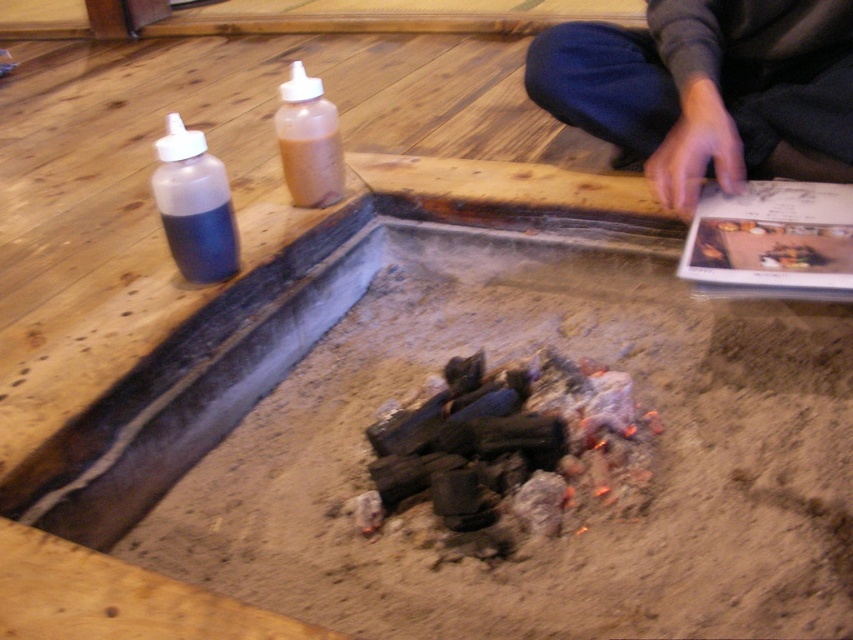
Please provide the 2D coordinates of the dark gray sweater at upper right in the image.

The dark gray sweater at upper right is located at coordinates (x=708, y=90).

Based on the photo, you are a guest at a campsite and need to choose a bottle to pour water into the fire pit. The transparent plastic bottle at left and the translucent plastic bottle at center are available. Which bottle can hold more water?

The translucent plastic bottle at center can hold more water because it is larger than the transparent plastic bottle at left.

You are organizing items in the area around the fire pit. You need to place the dark gray sweater at upper right and the translucent plastic bottle at center on a shelf that can only hold items narrower than the bottle. Will both items fit?

The dark gray sweater at upper right is wider than the translucent plastic bottle at center. Since the shelf can only hold items narrower than the bottle, the sweater will not fit, but the bottle will.